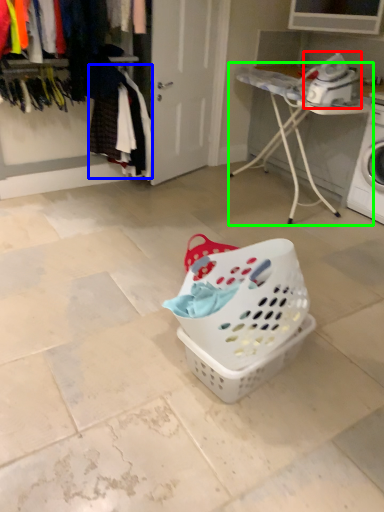
Question: Which object is the closest to the appliance (highlighted by a red box)? Choose among these: clothing (highlighted by a blue box) or furniture (highlighted by a green box).

Choices:
 (A) clothing
 (B) furniture

Answer: (B)